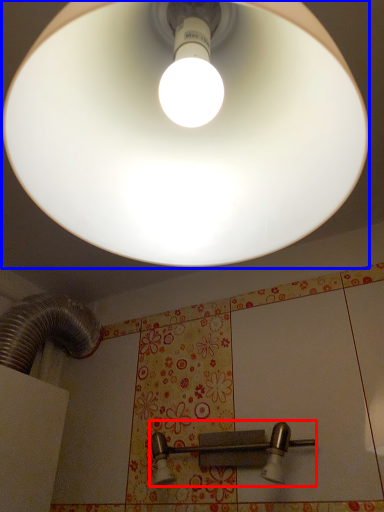
Question: Which object appears farthest to the camera in this image, door handle (highlighted by a red box) or lamp (highlighted by a blue box)?

Choices:
 (A) door handle
 (B) lamp

Answer: (A)